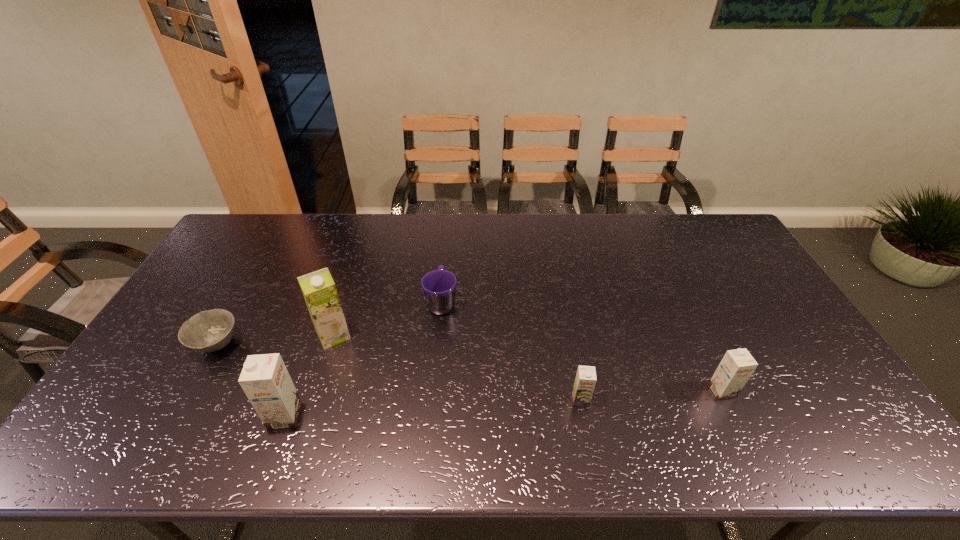
Image resolution: width=960 pixels, height=540 pixels. I want to click on free space between the leftmost chocolate milk and the soya milk, so click(309, 375).

I want to click on vacant point located between the soya milk and the fourth object from left to right, so click(388, 319).

You are a GUI agent. You are given a task and a screenshot of the screen. Output one action in this format:
    pyautogui.click(x=<x>, y=<y>)
    Task: Click on the vacant region between the mug and the second object from right to left
    This screenshot has width=960, height=540.
    Given the screenshot: What is the action you would take?
    pyautogui.click(x=511, y=350)

I want to click on vacant area that lies between the leftmost chocolate milk and the fourth shortest object, so click(503, 404).

You are a GUI agent. You are given a task and a screenshot of the screen. Output one action in this format:
    pyautogui.click(x=<x>, y=<y>)
    Task: Click on the vacant area that lies between the shortest chocolate milk and the soya milk
    The image size is (960, 540).
    Given the screenshot: What is the action you would take?
    pyautogui.click(x=457, y=367)

At what (x,y) coordinates should I click in order to perform the action: click on object that is the second closest one to the leftmost object. Please return your answer as a coordinate pair (x, y). The height and width of the screenshot is (540, 960). Looking at the image, I should click on (318, 288).

Where is `object identified as the second closest to the shortest object`? Image resolution: width=960 pixels, height=540 pixels. object identified as the second closest to the shortest object is located at coordinates (318, 288).

The width and height of the screenshot is (960, 540). Find the location of `chocolate milk object that ranks as the third closest to the bowl`. chocolate milk object that ranks as the third closest to the bowl is located at coordinates (736, 367).

Locate which chocolate milk is the second closest to the leftmost chocolate milk. Please provide its 2D coordinates. Your answer should be formatted as a tuple, i.e. [(x, y)], where the tuple contains the x and y coordinates of a point satisfying the conditions above.

[(736, 367)]

Locate an element on the screen. The height and width of the screenshot is (540, 960). vacant area in the image that satisfies the following two spatial constraints: 1. on the front side of the soya milk; 2. on the right side of the second chocolate milk from left to right is located at coordinates (313, 400).